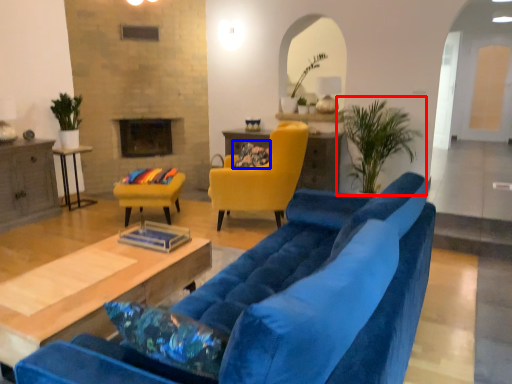
Question: Which object is further to the camera taking this photo, houseplant (highlighted by a red box) or pillow (highlighted by a blue box)?

Choices:
 (A) houseplant
 (B) pillow

Answer: (B)